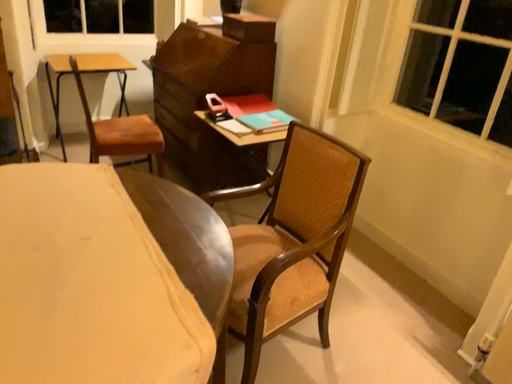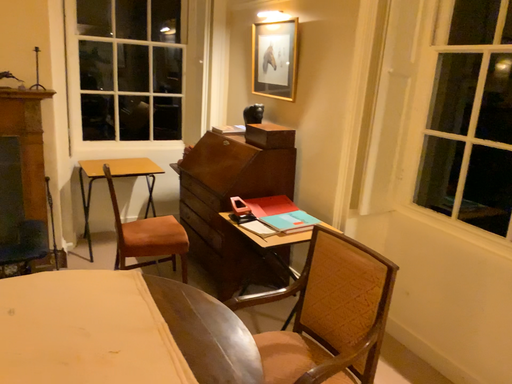
Question: How did the camera likely rotate when shooting the video?

Choices:
 (A) rotated upward
 (B) rotated downward

Answer: (A)